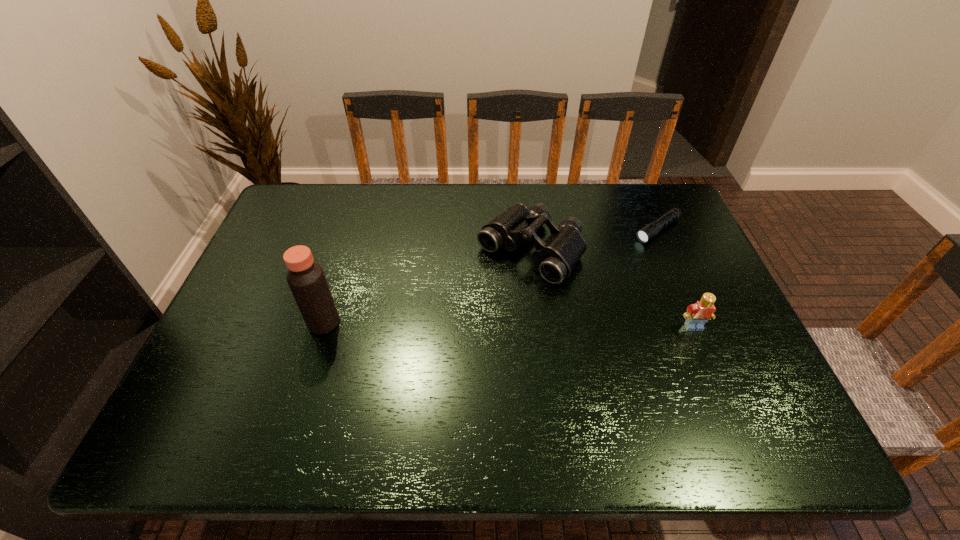
Where is `vacant area that lies between the vinegar and the Lego`? This screenshot has height=540, width=960. vacant area that lies between the vinegar and the Lego is located at coordinates (509, 325).

You are a GUI agent. You are given a task and a screenshot of the screen. Output one action in this format:
    pyautogui.click(x=<x>, y=<y>)
    Task: Click on the free spot between the binoculars and the Lego
    The height and width of the screenshot is (540, 960).
    Given the screenshot: What is the action you would take?
    pyautogui.click(x=612, y=288)

Locate an element on the screen. Image resolution: width=960 pixels, height=540 pixels. free area in between the leftmost object and the third object from right to left is located at coordinates (427, 287).

I want to click on vacant area that lies between the binoculars and the tallest object, so click(427, 287).

Where is `object that is the second closest to the Lego`? Image resolution: width=960 pixels, height=540 pixels. object that is the second closest to the Lego is located at coordinates (648, 232).

I want to click on the second closest object to the tallest object, so click(x=697, y=314).